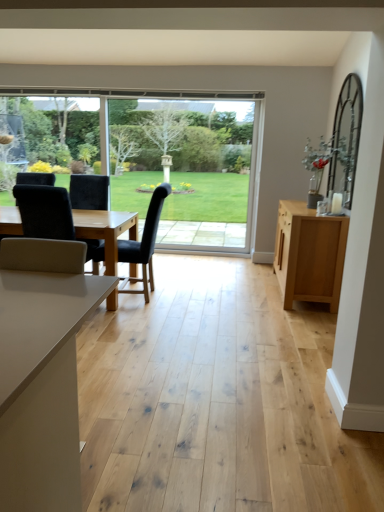
Question: Is black fabric chair at center, the 1th chair when ordered from right to left, bigger or smaller than velvet black chair at left, the second chair in the right-to-left sequence?

Choices:
 (A) big
 (B) small

Answer: (A)

Question: Is black fabric chair at center, the 1th chair when ordered from right to left, inside the boundaries of velvet black chair at left, the second chair in the right-to-left sequence, or outside?

Choices:
 (A) inside
 (B) outside

Answer: (B)

Question: Which object is positioned closest to the black fabric chair at center, the 1th chair when ordered from right to left?

Choices:
 (A) velvet black chair at left, the second chair in the right-to-left sequence
 (B) light wood cabinet at right
 (C) clear glass window at center

Answer: (A)

Question: Which is farther from the light wood cabinet at right?

Choices:
 (A) black fabric chair at center, arranged as the 2th chair when viewed from the left
 (B) clear glass window at center
 (C) velvet black chair at left, which appears as the 1th chair when viewed from the left

Answer: (B)